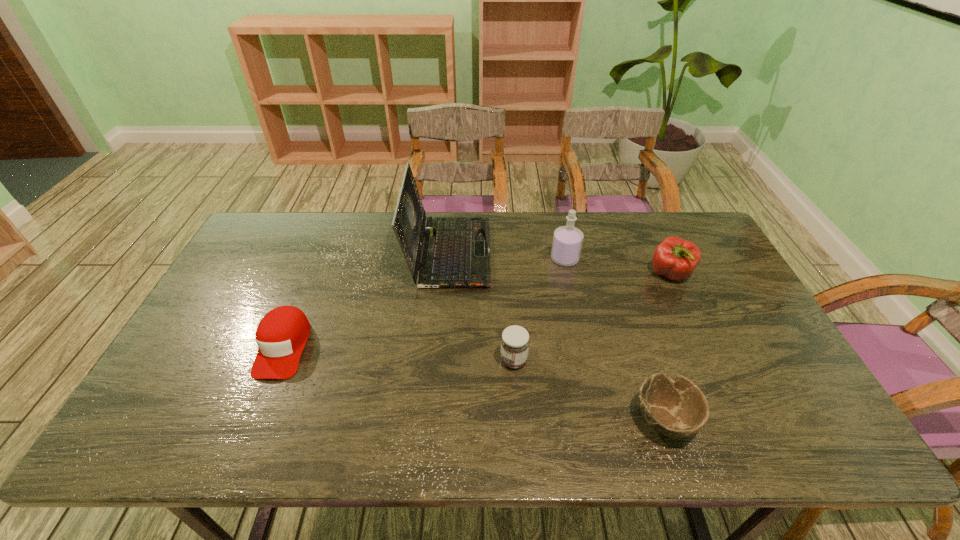
At what (x,y) coordinates should I click in order to perform the action: click on free spot that satisfies the following two spatial constraints: 1. on the back side of the bowl; 2. on the screen of the second object from left to right. Please return your answer as a coordinate pair (x, y). This screenshot has width=960, height=540. Looking at the image, I should click on (609, 253).

Locate an element on the screen. The image size is (960, 540). blank space that satisfies the following two spatial constraints: 1. on the screen of the second object from left to right; 2. on the front-facing side of the baseball cap is located at coordinates (442, 347).

You are a GUI agent. You are given a task and a screenshot of the screen. Output one action in this format:
    pyautogui.click(x=<x>, y=<y>)
    Task: Click on the vacant position in the image that satisfies the following two spatial constraints: 1. on the screen of the tallest object; 2. on the front-facing side of the baseball cap
    Image resolution: width=960 pixels, height=540 pixels.
    Given the screenshot: What is the action you would take?
    pyautogui.click(x=442, y=347)

Find the location of a particular element. vacant space that satisfies the following two spatial constraints: 1. on the screen of the laptop computer; 2. on the left side of the bowl is located at coordinates (436, 419).

Find the location of a particular element. Image resolution: width=960 pixels, height=540 pixels. vacant space that satisfies the following two spatial constraints: 1. on the screen of the second tallest object; 2. on the right side of the laptop computer is located at coordinates (448, 259).

Where is `free space that satisfies the following two spatial constraints: 1. on the screen of the fifth object from right to left; 2. on the left side of the second object from right to left`? This screenshot has width=960, height=540. free space that satisfies the following two spatial constraints: 1. on the screen of the fifth object from right to left; 2. on the left side of the second object from right to left is located at coordinates (436, 419).

You are a GUI agent. You are given a task and a screenshot of the screen. Output one action in this format:
    pyautogui.click(x=<x>, y=<y>)
    Task: Click on the vacant space that satisfies the following two spatial constraints: 1. on the front-facing side of the leftmost object; 2. on the left side of the bowl
    Image resolution: width=960 pixels, height=540 pixels.
    Given the screenshot: What is the action you would take?
    click(x=254, y=419)